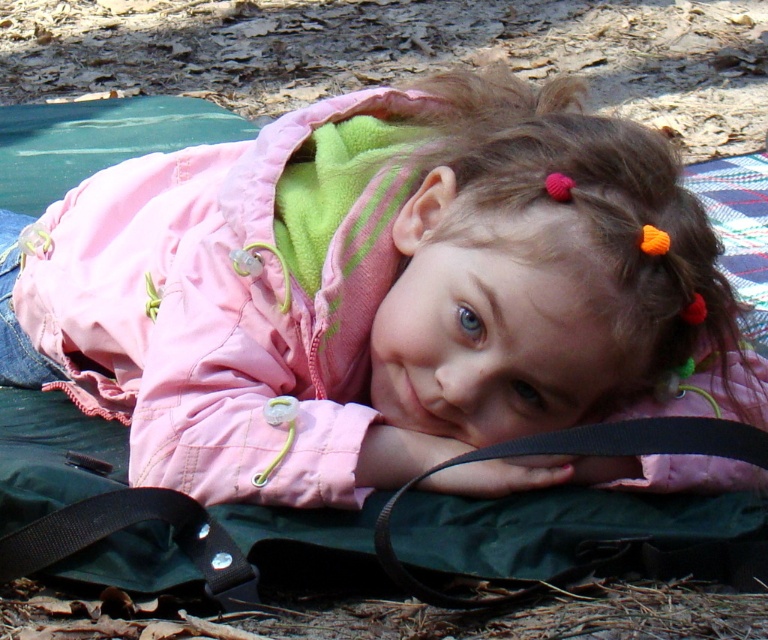
Can you confirm if pink fabric jacket at center is smaller than black fabric strap at lower left?

Incorrect, pink fabric jacket at center is not smaller in size than black fabric strap at lower left.

Is pink fabric jacket at center taller than black fabric strap at lower left?

Correct, pink fabric jacket at center is much taller as black fabric strap at lower left.

The height and width of the screenshot is (640, 768). Identify the location of pink fabric jacket at center. (372, 289).